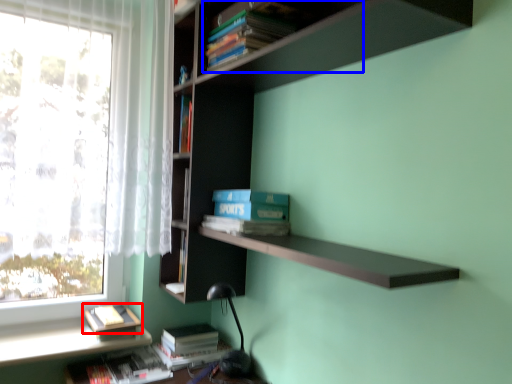
Question: Which point is closer to the camera, book (highlighted by a red box) or book (highlighted by a blue box)?

Choices:
 (A) book
 (B) book

Answer: (B)